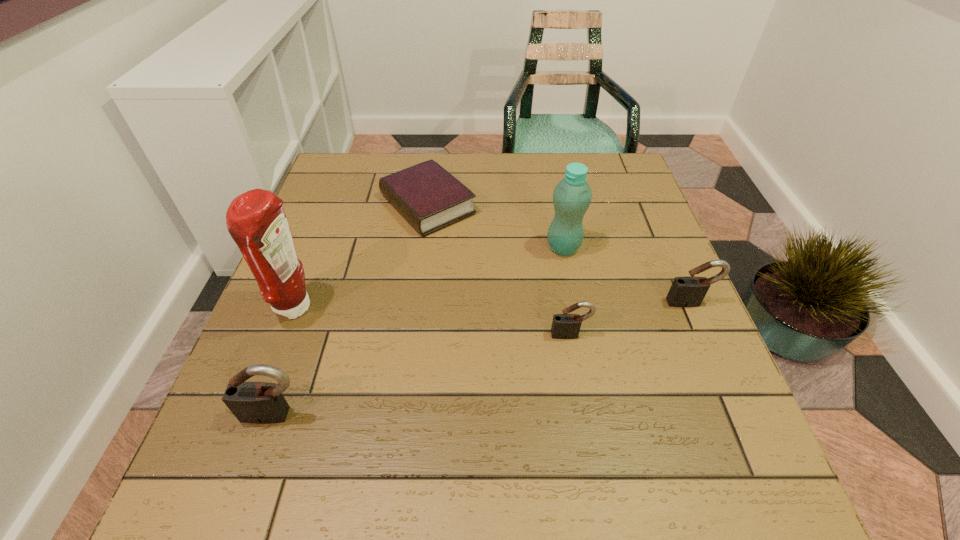
To ensure equal spacing by inserting another padlock among them, please point out a vacant spot for this new padlock. Please provide its 2D coordinates. Your answer should be formatted as a tuple, i.e. [(x, y)], where the tuple contains the x and y coordinates of a point satisfying the conditions above.

[(433, 372)]